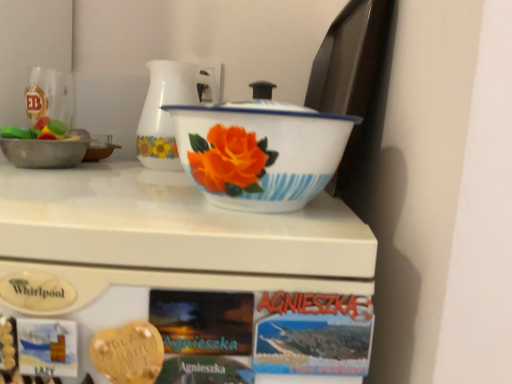
Describe the element at coordinates (175, 233) in the screenshot. This screenshot has width=512, height=384. I see `white glossy refrigerator at upper center` at that location.

Identify the location of golden heart-shaped cookie at center. The width and height of the screenshot is (512, 384). (128, 353).

Where is `white enamel basin at center`? The image size is (512, 384). white enamel basin at center is located at coordinates (259, 153).

Where is `white glossy jug at center`? Image resolution: width=512 pixels, height=384 pixels. white glossy jug at center is located at coordinates click(168, 113).

Does golden heart-shaped cookie at center touch white glossy jug at center?

golden heart-shaped cookie at center and white glossy jug at center are not in contact.

Locate an element on the screen. The image size is (512, 384). food beneath the white glossy jug at center (from a real-world perspective) is located at coordinates (128, 353).

From the image's perspective, is golden heart-shaped cookie at center over white glossy jug at center?

No, from the image's perspective, golden heart-shaped cookie at center is not over white glossy jug at center.

Between golden heart-shaped cookie at center and white glossy jug at center, which one has smaller size?

Smaller between the two is golden heart-shaped cookie at center.

Are white glossy refrigerator at upper center and white glossy jug at center making contact?

No, white glossy refrigerator at upper center is not next to white glossy jug at center.

Is white glossy refrigerator at upper center smaller than white glossy jug at center?

No, white glossy refrigerator at upper center is not smaller than white glossy jug at center.

Does white glossy refrigerator at upper center have a greater height compared to white glossy jug at center?

Yes, white glossy refrigerator at upper center is taller than white glossy jug at center.

From a real-world perspective, is white enamel basin at center above or below white glossy jug at center?

From a real-world perspective, white enamel basin at center is physically below white glossy jug at center.

Can you see white enamel basin at center touching white glossy jug at center?

No, white enamel basin at center is not next to white glossy jug at center.

From the image's perspective, which object appears higher, white enamel basin at center or white glossy jug at center?

white glossy jug at center, from the image's perspective.

Is white glossy jug at center to the left or to the right of golden heart-shaped cookie at center in the image?

Clearly, white glossy jug at center is on the left of golden heart-shaped cookie at center in the image.

Considering the relative sizes of white glossy jug at center and golden heart-shaped cookie at center in the image provided, is white glossy jug at center shorter than golden heart-shaped cookie at center?

In fact, white glossy jug at center may be taller than golden heart-shaped cookie at center.

Is white glossy jug at center turned away from golden heart-shaped cookie at center?

No, white glossy jug at center is not facing away from golden heart-shaped cookie at center.

Which is in front, point (150, 93) or point (98, 350)?

The point (98, 350) is in front.

Which of these two, white glossy jug at center or white enamel basin at center, stands shorter?

Standing shorter between the two is white enamel basin at center.

Is the position of white glossy jug at center less distant than that of white enamel basin at center?

No, white glossy jug at center is behind white enamel basin at center.

From a real-world perspective, relative to white enamel basin at center, is white glossy jug at center vertically above or below?

In terms of real-world spatial position, white glossy jug at center is above white enamel basin at center.

What's the angular difference between white glossy jug at center and white enamel basin at center's facing directions?

They differ by 0.904 degrees in their facing directions.

Is white glossy refrigerator at upper center located within golden heart-shaped cookie at center?

No, white glossy refrigerator at upper center is not a part of golden heart-shaped cookie at center.

Is white glossy refrigerator at upper center at the back of golden heart-shaped cookie at center?

Yes, golden heart-shaped cookie at center is positioned with its back facing white glossy refrigerator at upper center.

Does point (163, 350) appear closer or farther from the camera than point (220, 246)?

Point (163, 350) is farther from the camera than point (220, 246).

Considering the relative positions of golden heart-shaped cookie at center and white glossy refrigerator at upper center in the image provided, is golden heart-shaped cookie at center behind white glossy refrigerator at upper center?

Yes, it is behind white glossy refrigerator at upper center.

Between point (356, 229) and point (232, 139), which one is positioned in front?

The point (232, 139) is in front.

Can you confirm if white glossy refrigerator at upper center is thinner than white enamel basin at center?

Incorrect, the width of white glossy refrigerator at upper center is not less than that of white enamel basin at center.

Which of these two, white glossy refrigerator at upper center or white enamel basin at center, stands shorter?

white enamel basin at center.

Locate an element on the screen. The width and height of the screenshot is (512, 384). jug that is above the golden heart-shaped cookie at center (from a real-world perspective) is located at coordinates (168, 113).

At what (x,y) coordinates should I click in order to perform the action: click on table beneath the white glossy jug at center (from a real-world perspective). Please return your answer as a coordinate pair (x, y). This screenshot has width=512, height=384. Looking at the image, I should click on (175, 233).

Considering their positions, is white enamel basin at center positioned closer to golden heart-shaped cookie at center than white glossy jug at center?

Among the two, white enamel basin at center is located nearer to golden heart-shaped cookie at center.

Looking at the image, which one is located further to white glossy jug at center, white glossy refrigerator at upper center or golden heart-shaped cookie at center?

Based on the image, golden heart-shaped cookie at center appears to be further to white glossy jug at center.

Based on their spatial positions, is white glossy jug at center or golden heart-shaped cookie at center closer to white glossy refrigerator at upper center?

Based on the image, golden heart-shaped cookie at center appears to be nearer to white glossy refrigerator at upper center.

Looking at this image, based on their spatial positions, is white glossy refrigerator at upper center or golden heart-shaped cookie at center closer to white enamel basin at center?

white glossy refrigerator at upper center lies closer to white enamel basin at center than the other object.

Estimate the real-world distances between objects in this image. Which object is closer to white glossy jug at center, white enamel basin at center or golden heart-shaped cookie at center?

Based on the image, white enamel basin at center appears to be nearer to white glossy jug at center.

Estimate the real-world distances between objects in this image. Which object is further from white enamel basin at center, golden heart-shaped cookie at center or white glossy jug at center?

Among the two, white glossy jug at center is located further to white enamel basin at center.

Looking at this image, when comparing their distances from white enamel basin at center, does golden heart-shaped cookie at center or white glossy refrigerator at upper center seem closer?

Based on the image, white glossy refrigerator at upper center appears to be nearer to white enamel basin at center.

When comparing their distances from white enamel basin at center, does white glossy refrigerator at upper center or white glossy jug at center seem closer?

Among the two, white glossy refrigerator at upper center is located nearer to white enamel basin at center.

I want to click on food located between white glossy refrigerator at upper center and white glossy jug at center in the depth direction, so click(128, 353).

Locate an element on the screen. The image size is (512, 384). basin located between white glossy refrigerator at upper center and white glossy jug at center in the depth direction is located at coordinates (259, 153).

Find the location of `food that lies between white enamel basin at center and white glossy refrigerator at upper center from top to bottom`. food that lies between white enamel basin at center and white glossy refrigerator at upper center from top to bottom is located at coordinates pos(128,353).

Locate an element on the screen. The height and width of the screenshot is (384, 512). basin positioned between golden heart-shaped cookie at center and white glossy jug at center from near to far is located at coordinates click(x=259, y=153).